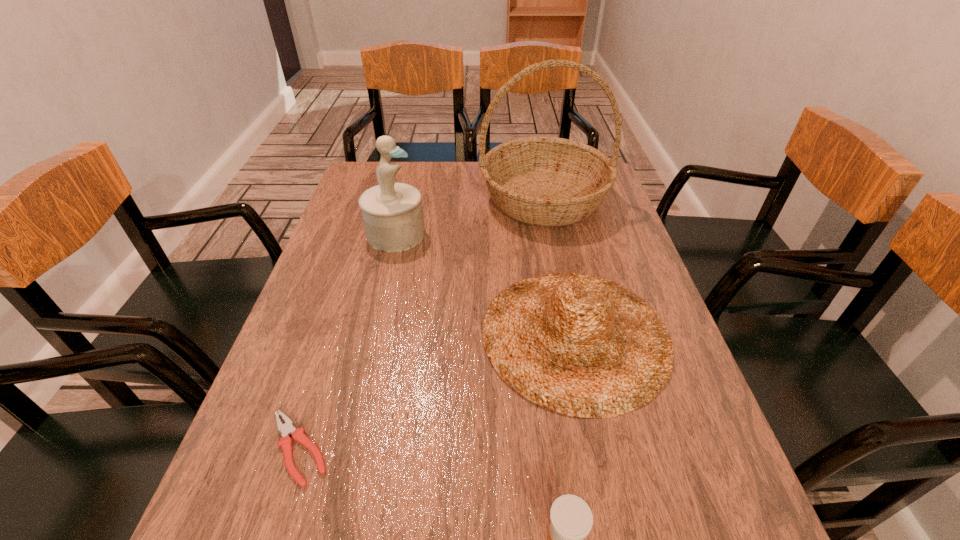
Where is `basket`? The height and width of the screenshot is (540, 960). basket is located at coordinates (545, 181).

The height and width of the screenshot is (540, 960). I want to click on the second tallest object, so click(392, 213).

I want to click on sunhat, so click(x=584, y=346).

The height and width of the screenshot is (540, 960). In order to click on pliers in this screenshot , I will do `click(286, 429)`.

Locate an element on the screen. The width and height of the screenshot is (960, 540). vacant space situated 0.160m on the left of the basket is located at coordinates (428, 199).

At what (x,y) coordinates should I click in order to perform the action: click on vacant space located 0.250m at the beak of the fourth shortest object. Please return your answer as a coordinate pair (x, y). This screenshot has width=960, height=540. Looking at the image, I should click on (514, 234).

The height and width of the screenshot is (540, 960). I want to click on vacant region located 0.100m on the left of the sunhat, so click(x=438, y=335).

Locate an element on the screen. Image resolution: width=960 pixels, height=540 pixels. free space located 0.170m on the back of the pliers is located at coordinates (332, 343).

Where is `object that is at the far edge`? object that is at the far edge is located at coordinates (545, 181).

Locate an element on the screen. Image resolution: width=960 pixels, height=540 pixels. figurine present at the left edge is located at coordinates (392, 213).